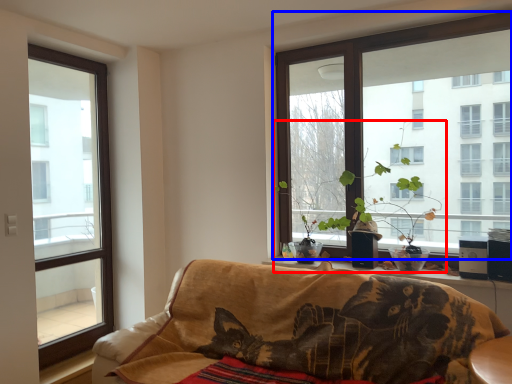
Question: Which point is further to the camera, houseplant (highlighted by a red box) or window (highlighted by a blue box)?

Choices:
 (A) houseplant
 (B) window

Answer: (A)